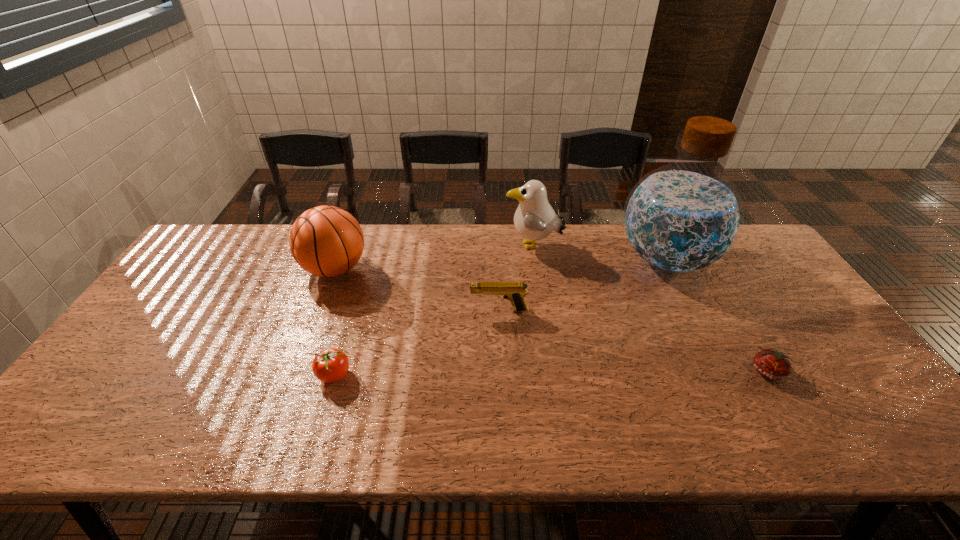
Identify the location of gull present at the far edge. (534, 219).

Locate an element on the screen. basketball at the far edge is located at coordinates (326, 241).

In the image, there is a desktop. Find the location of `vacant area at the far edge`. vacant area at the far edge is located at coordinates (x=499, y=239).

Image resolution: width=960 pixels, height=540 pixels. What are the coordinates of `free spot at the near edge of the desktop` in the screenshot? It's located at (123, 443).

The height and width of the screenshot is (540, 960). In the image, there is a desktop. What are the coordinates of `free space at the left edge` in the screenshot? It's located at (163, 302).

Identify the location of vacant space at the right edge of the desktop. (755, 271).

The image size is (960, 540). I want to click on vacant region at the far right corner, so click(752, 259).

At what (x,y) coordinates should I click in order to perform the action: click on blank area at the near right corner. Please return your answer as a coordinate pair (x, y). This screenshot has height=540, width=960. Looking at the image, I should click on (871, 446).

What are the coordinates of `free space between the basketball and the third shortest object` in the screenshot? It's located at (417, 290).

Find the location of a particular element. The height and width of the screenshot is (540, 960). free space between the gull and the basketball is located at coordinates (434, 258).